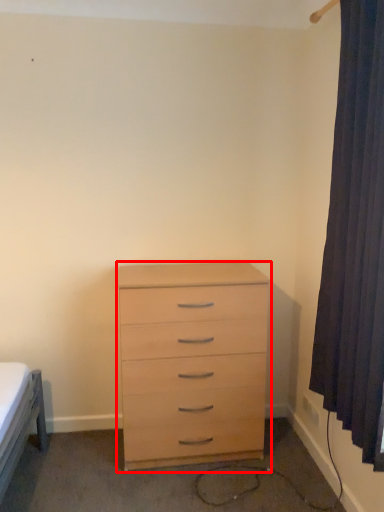
Question: From the image's perspective, where is chest of drawers (annotated by the red box) located in relation to curtain in the image?

Choices:
 (A) below
 (B) above

Answer: (A)